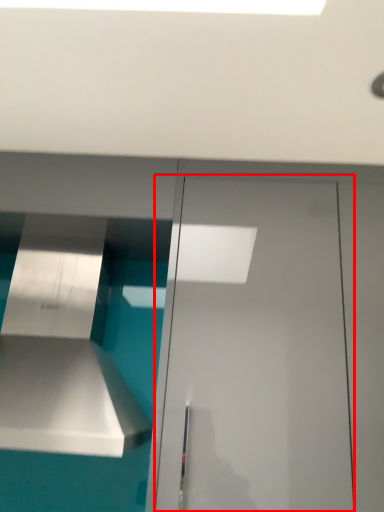
Question: Where is door (annotated by the red box) located in relation to vent in the image?

Choices:
 (A) left
 (B) right

Answer: (B)